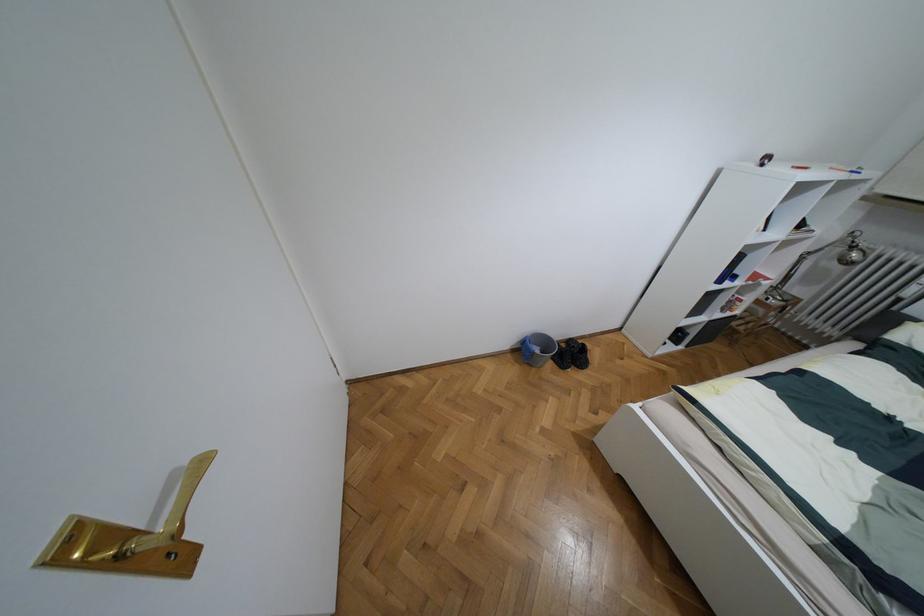
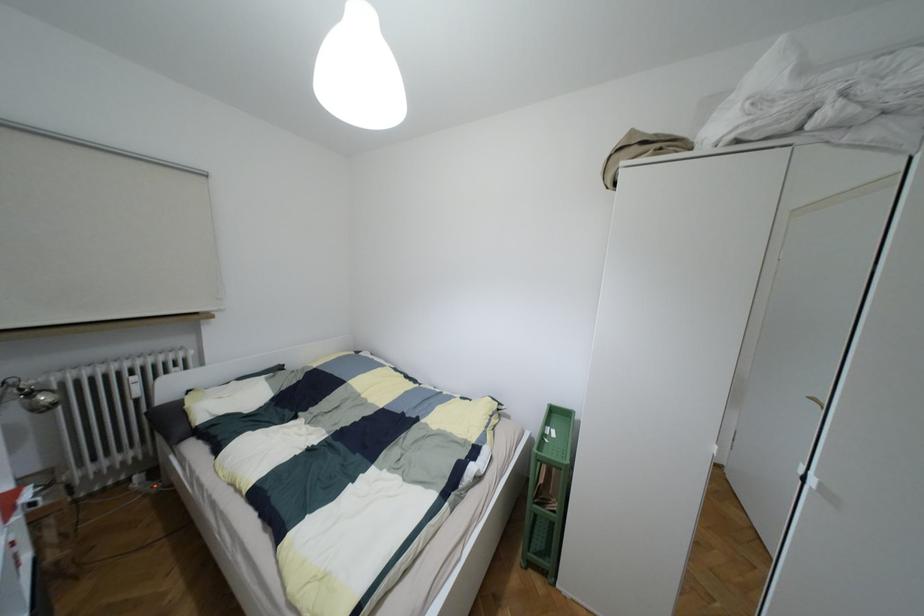
Where in the second image is the point corresponding to point 854,254 from the first image?

(43, 397)